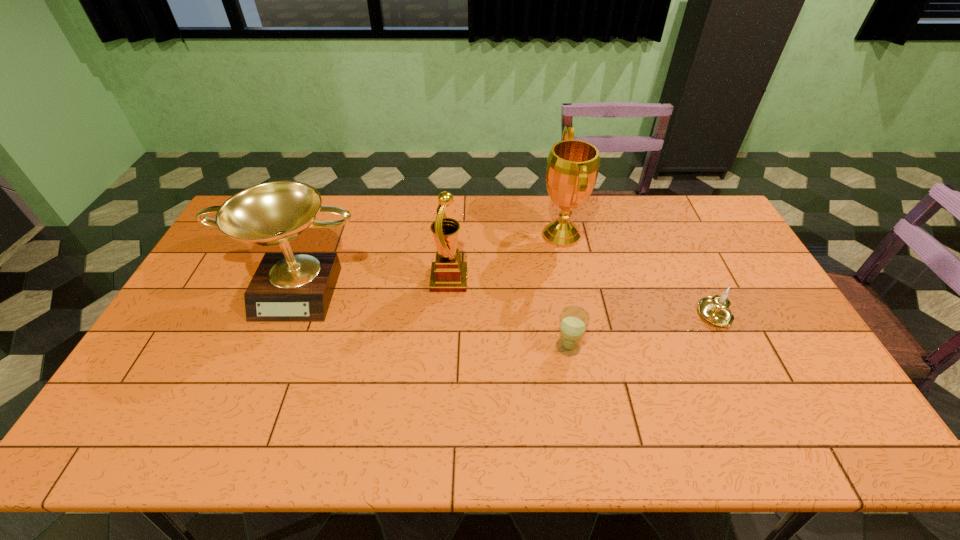
The width and height of the screenshot is (960, 540). Find the location of `vacant space that is in between the rightmost award and the candle holder`. vacant space that is in between the rightmost award and the candle holder is located at coordinates (638, 275).

This screenshot has height=540, width=960. In order to click on unoccupied position between the leftmost object and the candle holder in this screenshot , I will do pos(508,302).

Locate an element on the screen. empty space that is in between the leftmost object and the candle holder is located at coordinates (508, 302).

Where is `free space between the rightmost award and the leftmost object`? The width and height of the screenshot is (960, 540). free space between the rightmost award and the leftmost object is located at coordinates (431, 261).

Find the location of a particular element. vacant point located between the second award from right to left and the leftmost award is located at coordinates (374, 284).

Identify the location of empty space between the candle holder and the nearest object. The image size is (960, 540). (642, 332).

The image size is (960, 540). I want to click on empty space that is in between the leftmost award and the second object from left to right, so click(x=374, y=284).

This screenshot has width=960, height=540. Identify the location of vacant area that lies between the rightmost award and the leftmost award. (431, 261).

Find the location of a particular element. This screenshot has width=960, height=540. free space that is in between the candle holder and the glass is located at coordinates (642, 332).

Point out which object is positioned as the third nearest to the leftmost object. Please provide its 2D coordinates. Your answer should be formatted as a tuple, i.e. [(x, y)], where the tuple contains the x and y coordinates of a point satisfying the conditions above.

[(574, 320)]